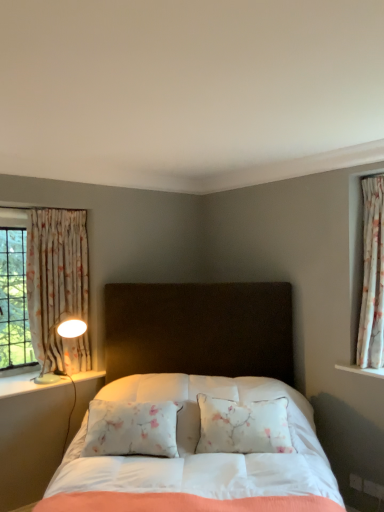
The image size is (384, 512). Find the location of `vacant region above floral fabric curtain at left, which is the 2th curtain in right-to-left order (from a real-world perspective)`. vacant region above floral fabric curtain at left, which is the 2th curtain in right-to-left order (from a real-world perspective) is located at coordinates (59, 206).